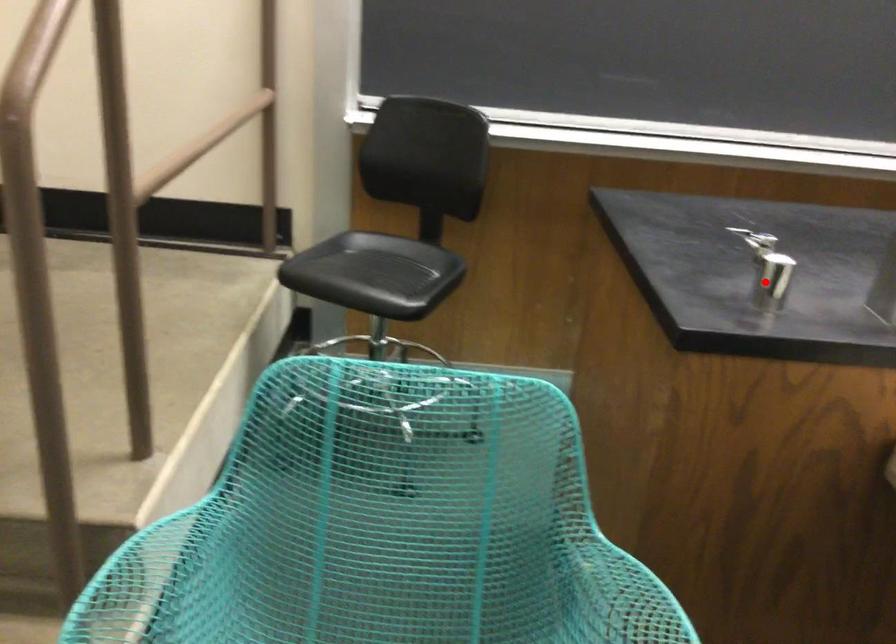
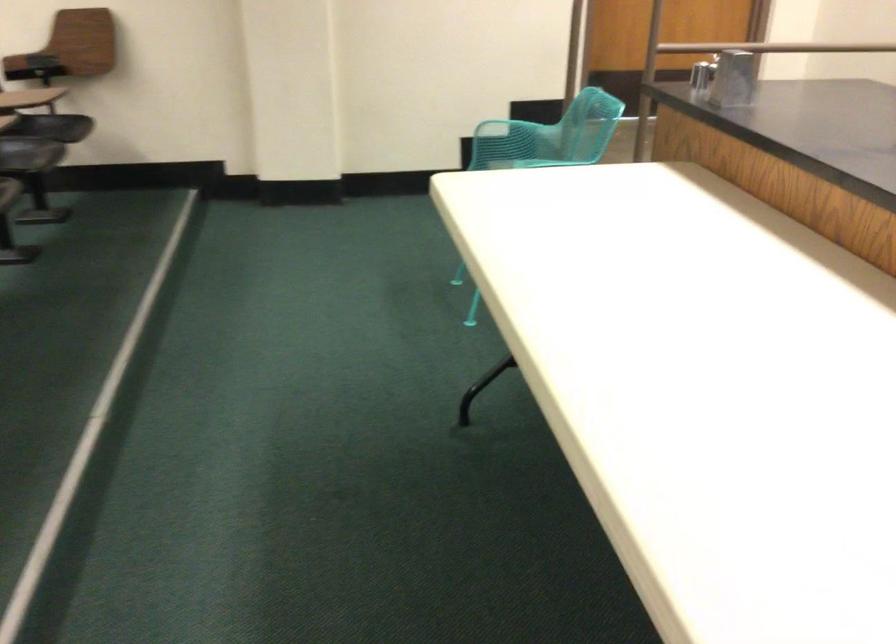
Question: I am providing you with two images of the same scene from different viewpoints. Given a red point in image1, look at the same physical point in image2. Is it:

Choices:
 (A) Closer to the viewpoint
 (B) Farther from the viewpoint

Answer: (B)